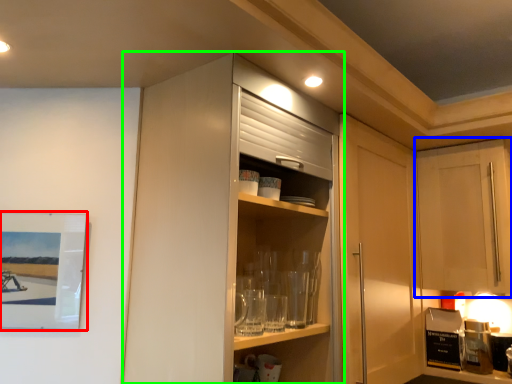
Question: Considering the real-world distances, which object is closest to picture frame (highlighted by a red box)? cabinetry (highlighted by a blue box) or cabinetry (highlighted by a green box).

Choices:
 (A) cabinetry
 (B) cabinetry

Answer: (B)